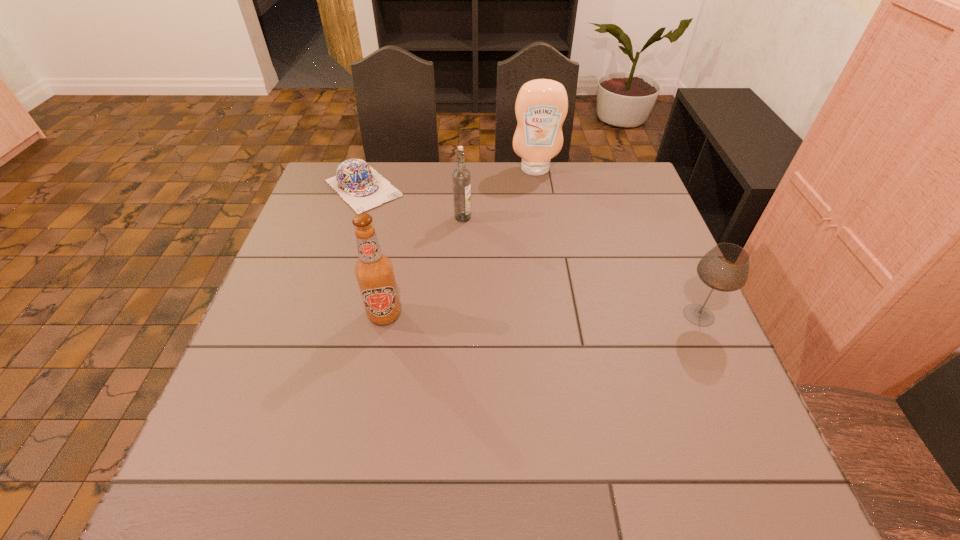
Identify the location of object that is at the left edge. This screenshot has height=540, width=960. (363, 188).

At what (x,y) coordinates should I click in order to perform the action: click on object at the right edge. Please return your answer as a coordinate pair (x, y). Looking at the image, I should click on (725, 267).

In order to click on object that is at the far left corner in this screenshot , I will do `click(363, 188)`.

In the image, there is a desktop. Where is `free space at the far edge`? This screenshot has width=960, height=540. free space at the far edge is located at coordinates (544, 183).

Where is `vacant space at the near edge`? Image resolution: width=960 pixels, height=540 pixels. vacant space at the near edge is located at coordinates [551, 414].

Identify the location of free space at the left edge of the desktop. (328, 212).

Locate an element on the screen. vacant space at the right edge of the desktop is located at coordinates (644, 249).

The image size is (960, 540). Find the location of `vacant region at the far left corner of the desktop`. vacant region at the far left corner of the desktop is located at coordinates (327, 186).

Identify the location of free region at the far right corner. point(619,169).

At what (x,y) coordinates should I click in order to perform the action: click on vacant space that's between the third shortest object and the shortest object. Please return your answer as a coordinate pair (x, y). Image resolution: width=960 pixels, height=540 pixels. Looking at the image, I should click on (413, 203).